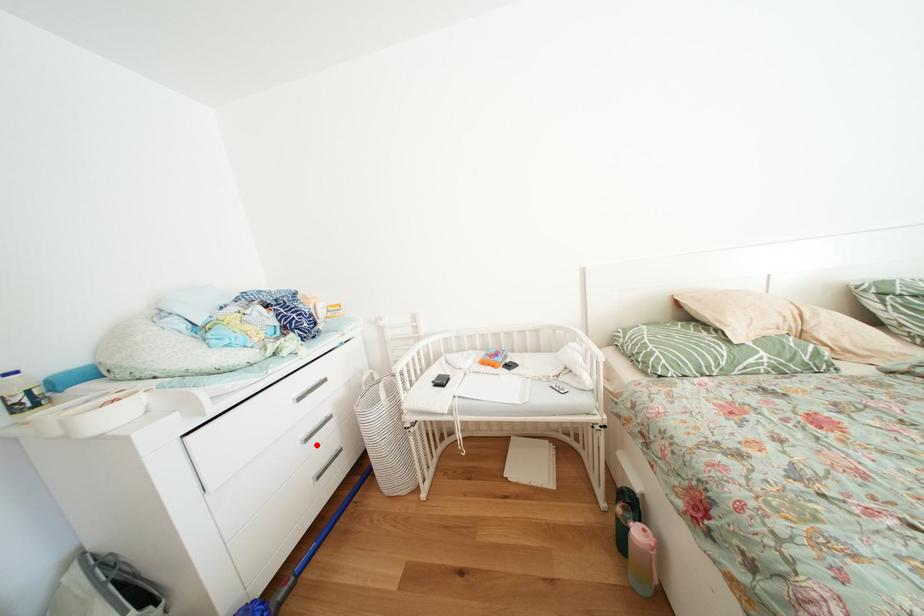
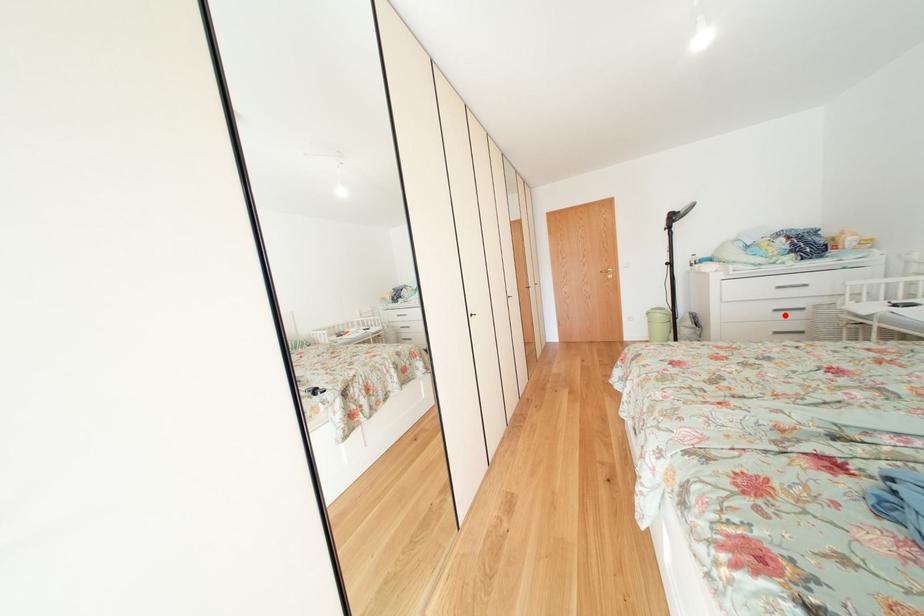
I am providing you with two images of the same scene from different viewpoints. A red point is marked on the first image and another point is marked on the second image. Does the point marked in image1 correspond to the same location as the one in image2?

Yes